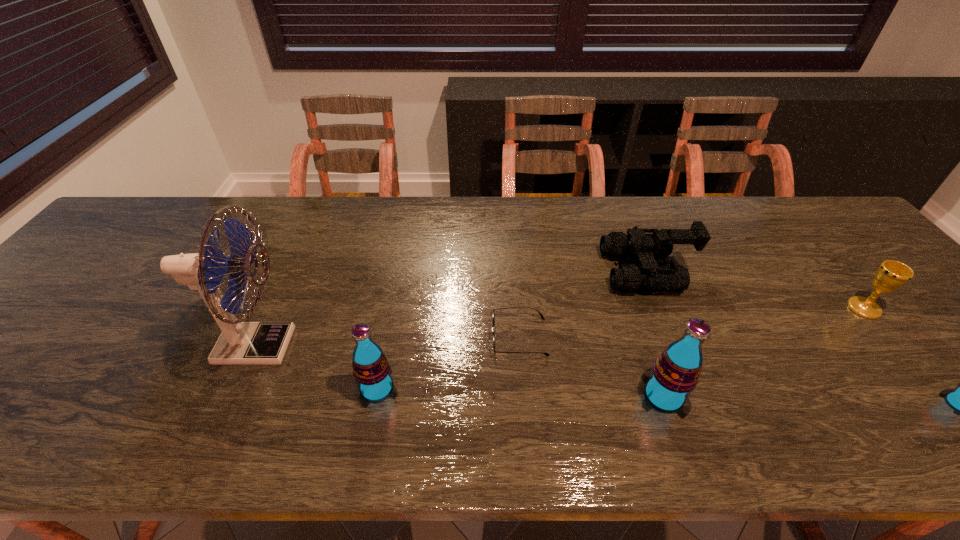
In order to click on the sixth object from right to left in this screenshot , I will do `click(371, 369)`.

Where is `the second tallest soda`? the second tallest soda is located at coordinates (371, 369).

At what (x,y) coordinates should I click in order to perform the action: click on the second soda from left to right. Please return your answer as a coordinate pair (x, y). This screenshot has width=960, height=540. Looking at the image, I should click on (675, 373).

In order to click on the farthest object in this screenshot , I will do `click(628, 278)`.

Locate an element on the screen. chalice is located at coordinates (891, 275).

You are a GUI agent. You are given a task and a screenshot of the screen. Output one action in this format:
    pyautogui.click(x=<x>, y=<y>)
    Task: Click on the shortest object
    The width and height of the screenshot is (960, 540).
    Given the screenshot: What is the action you would take?
    pyautogui.click(x=541, y=315)

Identify the location of spectacles. (541, 315).

Find the location of a particular element. fan is located at coordinates (241, 343).

Identify the location of the leftmost object. (241, 343).

In order to click on free region located 0.350m on the back of the fifth shortest object in this screenshot , I will do `click(401, 263)`.